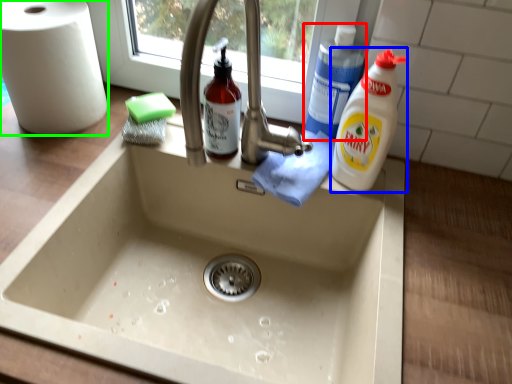
Question: Estimate the real-world distances between objects in this image. Which object is closer to cleaning product (highlighted by a red box), cleaning product (highlighted by a blue box) or paper towel (highlighted by a green box)?

Choices:
 (A) cleaning product
 (B) paper towel

Answer: (A)